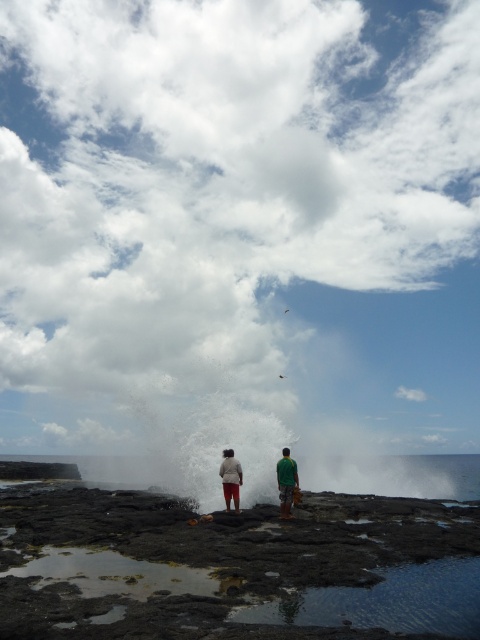
Question: Can you confirm if matte green shirt at center is bigger than green matte shirt at center?

Choices:
 (A) yes
 (B) no

Answer: (B)

Question: Which of the following is the closest to the observer?

Choices:
 (A) lava rock at center
 (B) matte green shirt at center
 (C) matte white pants at center

Answer: (A)

Question: Which point appears closest to the camera in this image?

Choices:
 (A) (228, 458)
 (B) (280, 480)
 (C) (235, 472)
 (D) (10, 509)

Answer: (B)

Question: Estimate the real-world distances between objects in this image. Which object is farther from the green matte shirt at center?

Choices:
 (A) matte white pants at center
 (B) matte green shirt at center
 (C) lava rock at center

Answer: (C)

Question: Is lava rock at center thinner than green matte shirt at center?

Choices:
 (A) no
 (B) yes

Answer: (A)

Question: From the image, what is the correct spatial relationship of lava rock at center in relation to matte green shirt at center?

Choices:
 (A) right
 (B) left

Answer: (A)